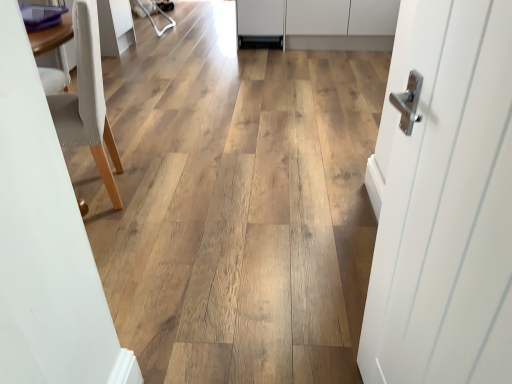
This screenshot has height=384, width=512. Find the location of `vacant space behind light beige fabric chair at left`. vacant space behind light beige fabric chair at left is located at coordinates (144, 144).